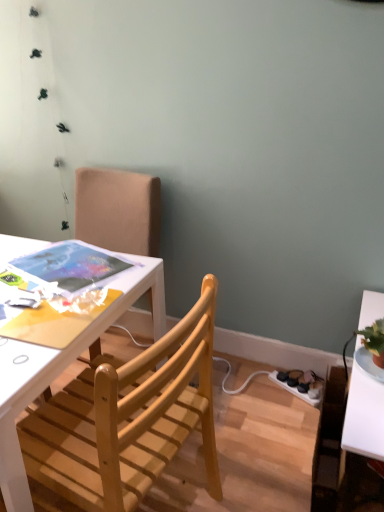
Question: Is light wood chair at center, arranged as the second chair when viewed from the back, smaller than white plastic power outlet at lower right?

Choices:
 (A) yes
 (B) no

Answer: (B)

Question: From the image's perspective, is light wood chair at center, which is the 1th chair in front-to-back order, over white plastic power outlet at lower right?

Choices:
 (A) no
 (B) yes

Answer: (B)

Question: Could you tell me if light wood chair at center, arranged as the second chair when viewed from the back, is facing white plastic power outlet at lower right?

Choices:
 (A) yes
 (B) no

Answer: (B)

Question: Is light wood chair at center, which is the 1th chair in front-to-back order, not within white plastic power outlet at lower right?

Choices:
 (A) yes
 (B) no

Answer: (A)

Question: Considering the relative sizes of light wood chair at center, arranged as the second chair when viewed from the back, and white plastic power outlet at lower right in the image provided, is light wood chair at center, arranged as the second chair when viewed from the back, thinner than white plastic power outlet at lower right?

Choices:
 (A) no
 (B) yes

Answer: (A)

Question: Does light wood chair at center, arranged as the second chair when viewed from the back, contain white plastic power outlet at lower right?

Choices:
 (A) no
 (B) yes

Answer: (A)

Question: Is white plastic power outlet at lower right outside light wood chair at center, arranged as the second chair when viewed from the back?

Choices:
 (A) no
 (B) yes

Answer: (B)

Question: From the image's perspective, is white plastic power outlet at lower right under light wood chair at center, which is the 1th chair in front-to-back order?

Choices:
 (A) yes
 (B) no

Answer: (A)

Question: Can you confirm if white plastic power outlet at lower right is shorter than light wood chair at center, arranged as the second chair when viewed from the back?

Choices:
 (A) yes
 (B) no

Answer: (A)

Question: Can you confirm if white plastic power outlet at lower right is wider than light wood chair at center, arranged as the second chair when viewed from the back?

Choices:
 (A) no
 (B) yes

Answer: (A)

Question: Is white plastic power outlet at lower right aimed at light wood chair at center, which is the 1th chair in front-to-back order?

Choices:
 (A) no
 (B) yes

Answer: (A)

Question: From a real-world perspective, is white plastic power outlet at lower right positioned under light wood chair at center, which is the 1th chair in front-to-back order, based on gravity?

Choices:
 (A) yes
 (B) no

Answer: (A)

Question: From the image's perspective, is wooden chair at upper left, which is counted as the first chair, starting from the back, located above white plastic power outlet at lower right?

Choices:
 (A) no
 (B) yes

Answer: (B)